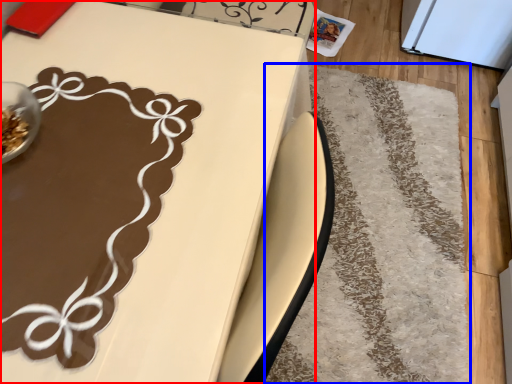
Question: Which object is closer to the camera taking this photo, table (highlighted by a red box) or mat (highlighted by a blue box)?

Choices:
 (A) table
 (B) mat

Answer: (A)